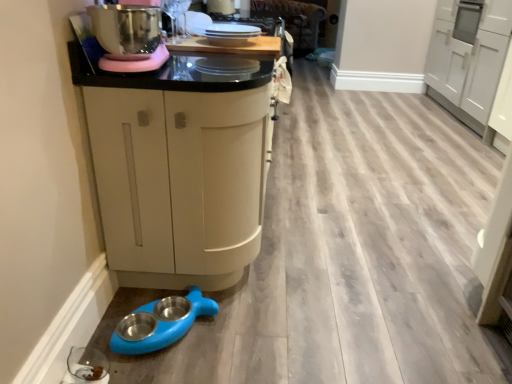
Question: Is transparent glass bowl at lower left, which is counted as the first appliance, starting from the bottom, not near white glossy cabinet at upper right, which is the 1th cabinetry from back to front?

Choices:
 (A) yes
 (B) no

Answer: (A)

Question: Can you confirm if transparent glass bowl at lower left, the 2th appliance when ordered from back to front, is smaller than white glossy cabinet at upper right, which is the 1th cabinetry from back to front?

Choices:
 (A) yes
 (B) no

Answer: (A)

Question: Is transparent glass bowl at lower left, the 2th appliance when ordered from back to front, to the left of white glossy cabinet at upper right, which appears as the 2th cabinetry when viewed from the front, from the viewer's perspective?

Choices:
 (A) yes
 (B) no

Answer: (A)

Question: Can you confirm if transparent glass bowl at lower left, which is the second appliance from right to left, is shorter than white glossy cabinet at upper right, arranged as the 1th cabinetry when viewed from the right?

Choices:
 (A) no
 (B) yes

Answer: (B)

Question: Is transparent glass bowl at lower left, acting as the second appliance starting from the top, not inside white glossy cabinet at upper right, arranged as the 1th cabinetry when viewed from the right?

Choices:
 (A) yes
 (B) no

Answer: (A)

Question: Is transparent glass bowl at lower left, the 2th appliance when ordered from back to front, aimed at white glossy cabinet at upper right, which is the 1th cabinetry from back to front?

Choices:
 (A) yes
 (B) no

Answer: (B)

Question: From a real-world perspective, is wooden surface at upper center physically above white glossy plates at upper center, which is the 1th appliance in right-to-left order?

Choices:
 (A) yes
 (B) no

Answer: (B)

Question: Considering the relative sizes of wooden surface at upper center and white glossy plates at upper center, which ranks as the 2th appliance in front-to-back order, in the image provided, is wooden surface at upper center wider than white glossy plates at upper center, which ranks as the 2th appliance in front-to-back order,?

Choices:
 (A) yes
 (B) no

Answer: (A)

Question: Is the position of wooden surface at upper center less distant than that of white glossy plates at upper center, positioned as the first appliance in top-to-bottom order?

Choices:
 (A) no
 (B) yes

Answer: (A)

Question: Considering the relative sizes of wooden surface at upper center and white glossy plates at upper center, positioned as the first appliance in top-to-bottom order, in the image provided, is wooden surface at upper center taller than white glossy plates at upper center, positioned as the first appliance in top-to-bottom order,?

Choices:
 (A) no
 (B) yes

Answer: (A)

Question: Is wooden surface at upper center positioned far away from white glossy plates at upper center, positioned as the first appliance in top-to-bottom order?

Choices:
 (A) yes
 (B) no

Answer: (B)

Question: Is wooden surface at upper center in contact with white glossy plates at upper center, arranged as the first appliance when viewed from the back?

Choices:
 (A) no
 (B) yes

Answer: (B)

Question: Considering the relative sizes of transparent glass bowl at lower left, the 2th appliance when ordered from back to front, and blue rubber pet bowls at lower left in the image provided, is transparent glass bowl at lower left, the 2th appliance when ordered from back to front, bigger than blue rubber pet bowls at lower left?

Choices:
 (A) no
 (B) yes

Answer: (A)